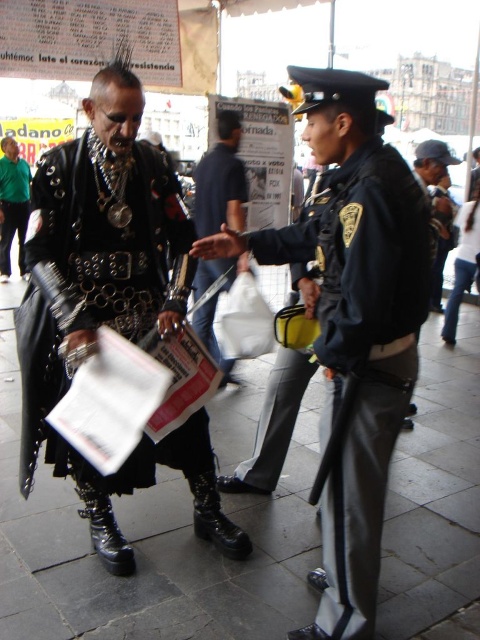
You are a photographer trying to capture a candid shot of both the dark blue uniform at center and the matte black leather jacket at left. Since you want to ensure both subjects are in focus, which one should you focus on first to maximize clarity for both?

You should focus on the dark blue uniform at center first because it is closer to the viewer, allowing the matte black leather jacket at left to remain in focus as well due to the depth of field.

You are a photographer trying to capture both the dark blue uniform at center and the matte black leather jacket at left in a single frame. Given their sizes, which object should you focus on to ensure both are clearly visible in the photo?

The dark blue uniform at center is bigger than the matte black leather jacket at left, so focusing on the dark blue uniform at center would help ensure both are clearly visible in the photo.

You are a photographer trying to capture both the dark blue uniform at center and the leather jacket at center in a single frame. Given their sizes, which one should you focus on to ensure both are visible without zooming in or out?

The dark blue uniform at center is larger in size compared to the leather jacket at center, so focusing on the dark blue uniform at center while keeping the leather jacket at center in the frame will ensure both are visible without needing to adjust the zoom.